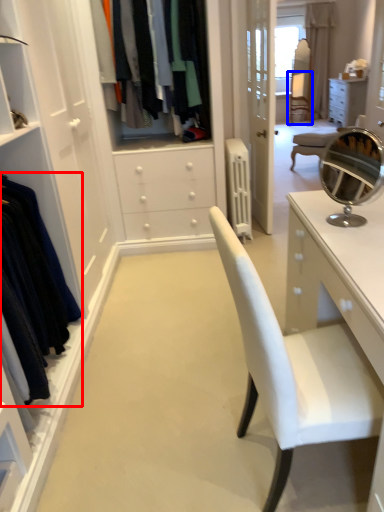
Question: Among these objects, which one is nearest to the camera, clothing (highlighted by a red box) or armchair (highlighted by a blue box)?

Choices:
 (A) clothing
 (B) armchair

Answer: (A)